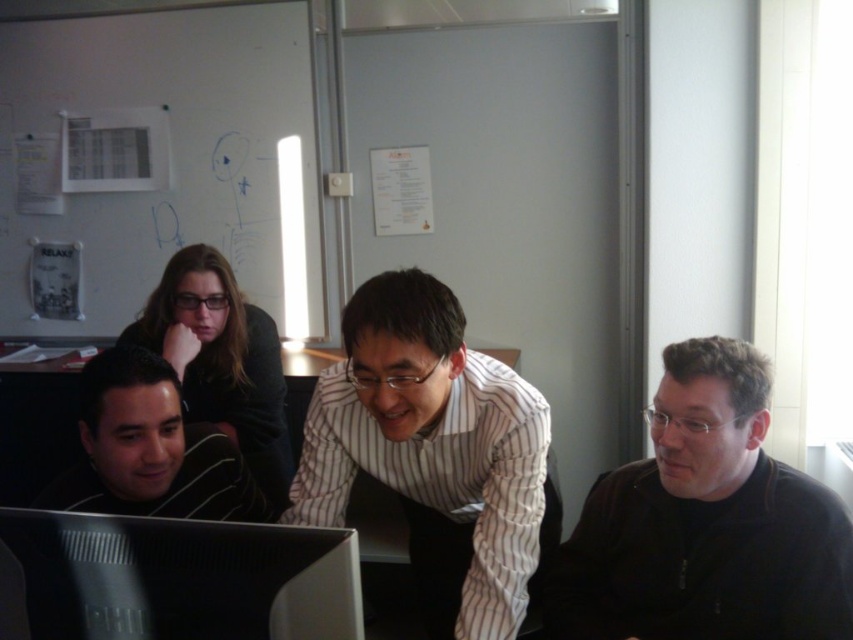
Is white striped shirt at center positioned behind black matte shirt at lower left?

No, it is in front of black matte shirt at lower left.

How much distance is there between white striped shirt at center and black matte shirt at lower left?

12.40 inches

Where is `white striped shirt at center`? The height and width of the screenshot is (640, 853). white striped shirt at center is located at coordinates (432, 451).

Is white striped shirt at center bigger than matte black monitor at lower left?

Yes.

Between point (389, 300) and point (103, 611), which one is positioned behind?

Positioned behind is point (389, 300).

Image resolution: width=853 pixels, height=640 pixels. Identify the location of white striped shirt at center. (432, 451).

In order to click on white striped shirt at center in this screenshot , I will do point(432,451).

Is matte black monitor at lower left taller than black matte shirt at lower left?

No, matte black monitor at lower left is not taller than black matte shirt at lower left.

Is matte black monitor at lower left thinner than black matte shirt at lower left?

In fact, matte black monitor at lower left might be wider than black matte shirt at lower left.

Image resolution: width=853 pixels, height=640 pixels. What are the coordinates of `matte black monitor at lower left` in the screenshot? It's located at (173, 579).

At what (x,y) coordinates should I click in order to perform the action: click on matte black monitor at lower left. Please return your answer as a coordinate pair (x, y). The width and height of the screenshot is (853, 640). Looking at the image, I should click on (173, 579).